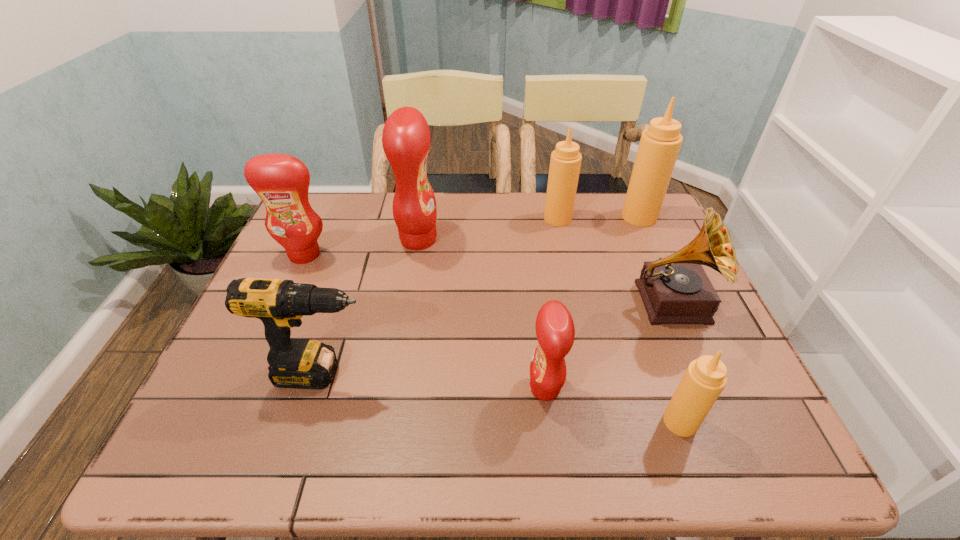
The height and width of the screenshot is (540, 960). I want to click on free location located 0.380m at the tip of the drill, so click(550, 373).

Find the location of a particular element. Image resolution: width=960 pixels, height=540 pixels. vacant space situated on the label side of the rightmost red condiment is located at coordinates (405, 388).

The height and width of the screenshot is (540, 960). I want to click on free space located on the label side of the rightmost red condiment, so click(x=405, y=388).

In order to click on vacant space located on the label side of the rightmost red condiment in this screenshot , I will do `click(376, 388)`.

You are a GUI agent. You are given a task and a screenshot of the screen. Output one action in this format:
    pyautogui.click(x=<x>, y=<y>)
    Task: Click on the free space located 0.170m on the back of the second tan condiment from left to right
    Image resolution: width=960 pixels, height=540 pixels.
    Given the screenshot: What is the action you would take?
    tap(651, 341)

Where is `object located in the near edge section of the desktop`? This screenshot has width=960, height=540. object located in the near edge section of the desktop is located at coordinates (705, 378).

I want to click on condiment at the left edge, so click(x=282, y=181).

Locate an element on the screen. drill at the left edge is located at coordinates (294, 363).

At what (x,y) coordinates should I click in order to perform the action: click on phonograph record that is at the right edge. Please return your answer as a coordinate pair (x, y). Looking at the image, I should click on (675, 290).

What are the coordinates of `object located in the far right corner section of the desktop` in the screenshot? It's located at (660, 143).